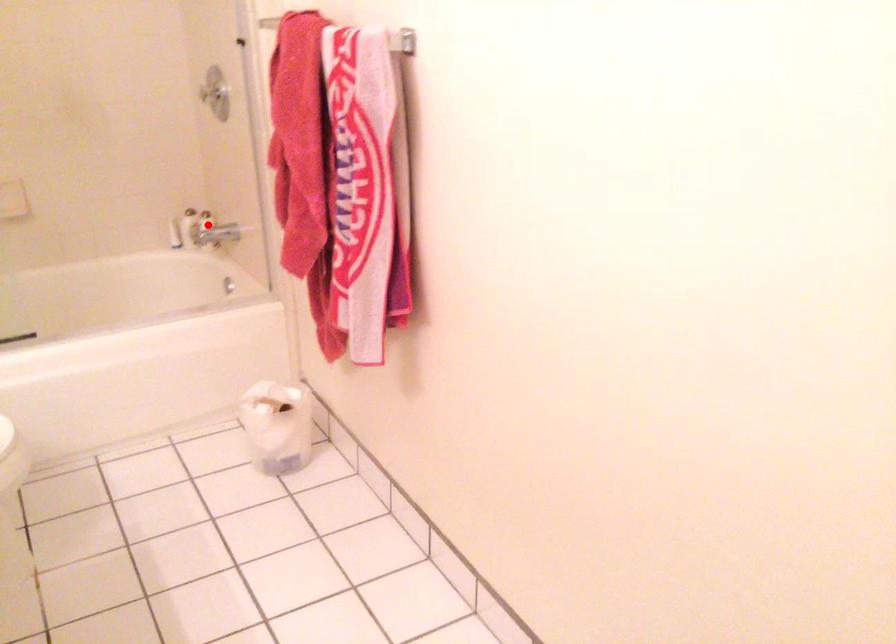
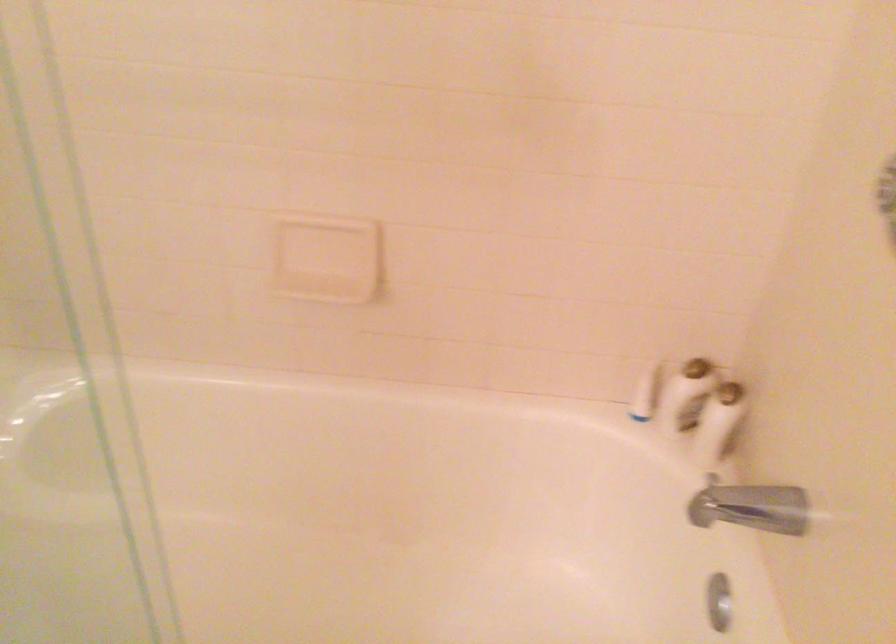
Question: I am providing you with two images of the same scene from different viewpoints. Given a red point in image1, look at the same physical point in image2. Is it:

Choices:
 (A) Closer to the viewpoint
 (B) Farther from the viewpoint

Answer: (A)